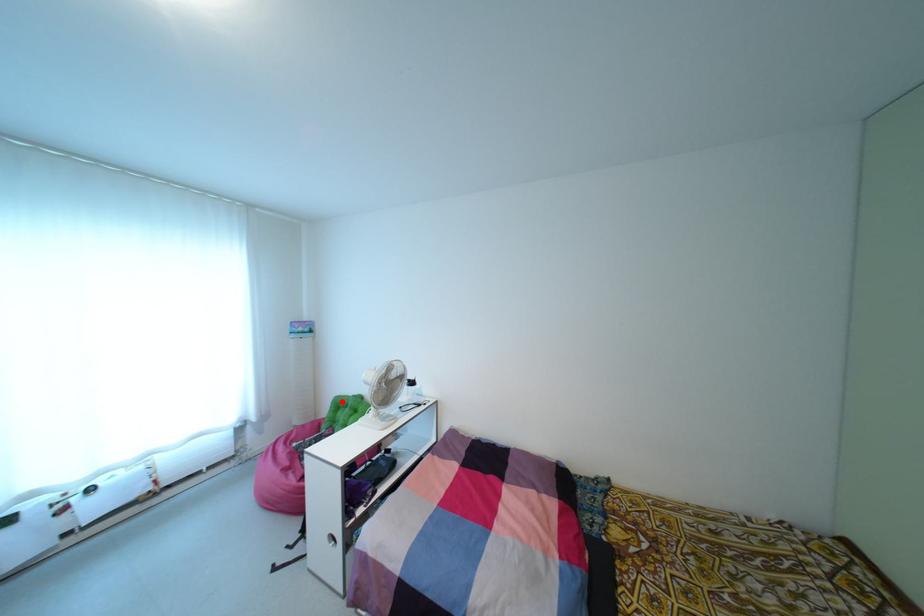
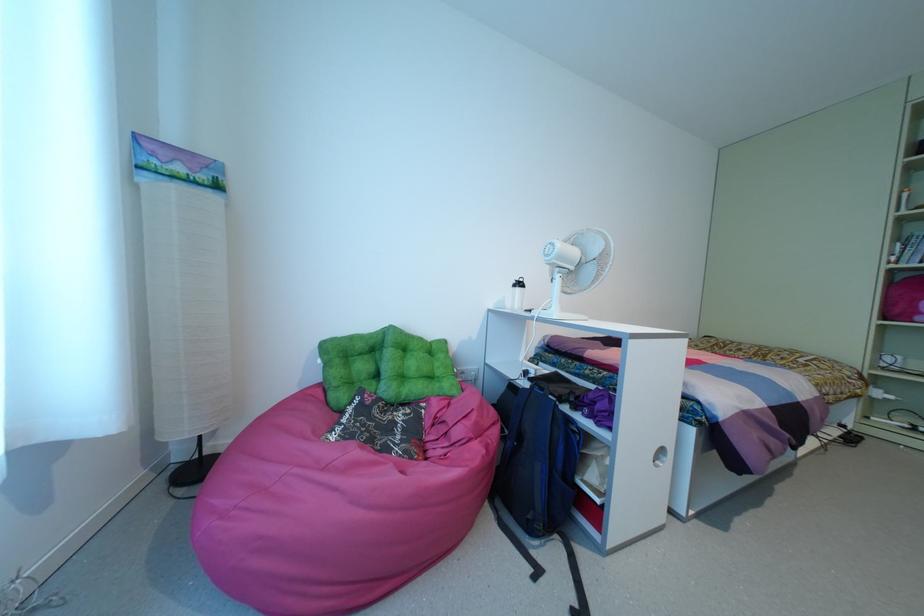
Find the pixel in the second image that matches the highlighted location in the first image.

(359, 345)